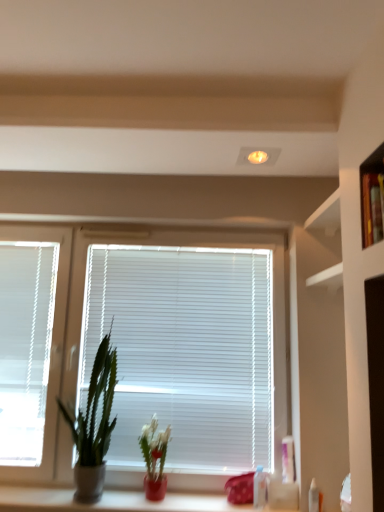
Locate an element on the screen. Image resolution: width=384 pixels, height=512 pixels. vacant space situated on the left part of transparent plastic bottle at lower right, which is counted as the first toiletry, starting from the left is located at coordinates coord(225,507).